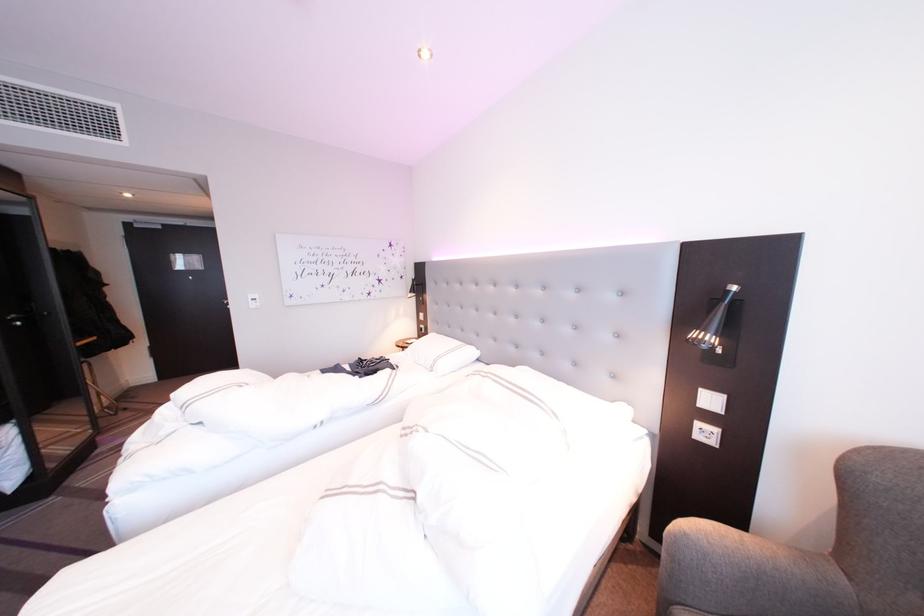
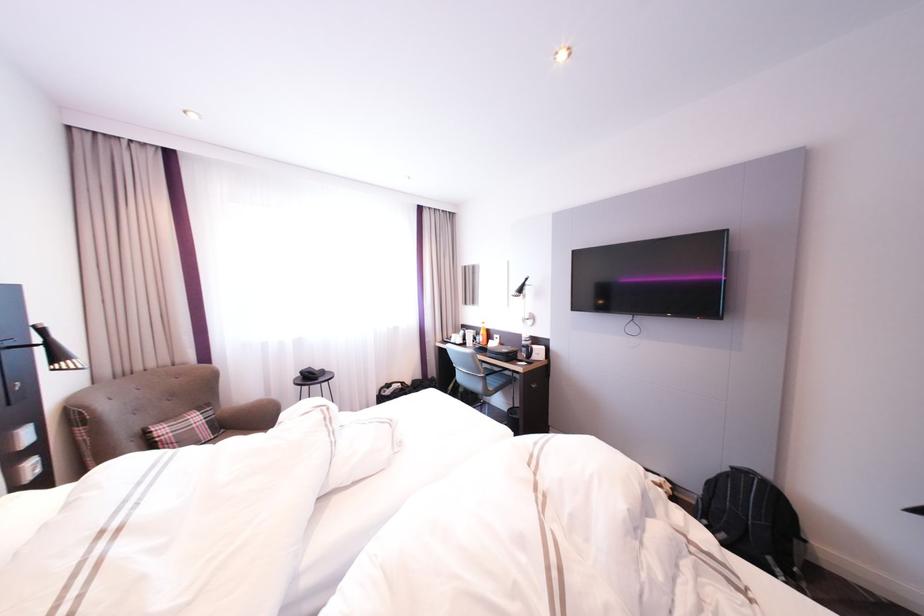
The point at (737, 398) is marked in the first image. Where is the corresponding point in the second image?

(43, 424)